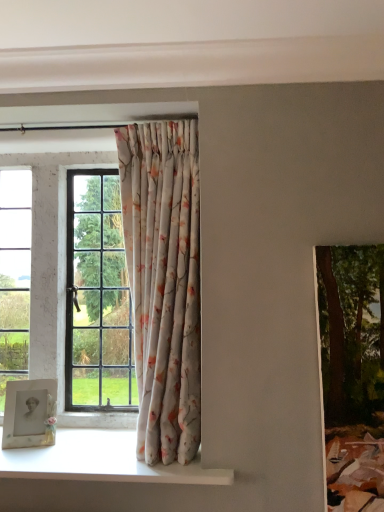
Question: Does matte white picture frame at lower left appear on the right side of floral fabric curtain at center?

Choices:
 (A) no
 (B) yes

Answer: (A)

Question: Is matte white picture frame at lower left beside floral fabric curtain at center?

Choices:
 (A) yes
 (B) no

Answer: (B)

Question: Is matte white picture frame at lower left oriented towards floral fabric curtain at center?

Choices:
 (A) no
 (B) yes

Answer: (A)

Question: Is matte white picture frame at lower left to the left of floral fabric curtain at center from the viewer's perspective?

Choices:
 (A) no
 (B) yes

Answer: (B)

Question: Considering the relative sizes of matte white picture frame at lower left and floral fabric curtain at center in the image provided, is matte white picture frame at lower left bigger than floral fabric curtain at center?

Choices:
 (A) yes
 (B) no

Answer: (B)

Question: Considering the relative sizes of matte white picture frame at lower left and floral fabric curtain at center in the image provided, is matte white picture frame at lower left thinner than floral fabric curtain at center?

Choices:
 (A) yes
 (B) no

Answer: (A)

Question: Is green textured painting at right positioned behind matte white picture frame at lower left?

Choices:
 (A) no
 (B) yes

Answer: (A)

Question: Does green textured painting at right have a lesser height compared to matte white picture frame at lower left?

Choices:
 (A) yes
 (B) no

Answer: (B)

Question: Can you confirm if green textured painting at right is positioned to the left of matte white picture frame at lower left?

Choices:
 (A) yes
 (B) no

Answer: (B)

Question: Can you confirm if green textured painting at right is bigger than matte white picture frame at lower left?

Choices:
 (A) yes
 (B) no

Answer: (A)

Question: Does green textured painting at right have a greater height compared to matte white picture frame at lower left?

Choices:
 (A) no
 (B) yes

Answer: (B)

Question: Is green textured painting at right outside matte white picture frame at lower left?

Choices:
 (A) no
 (B) yes

Answer: (B)

Question: Is matte white picture frame at lower left turned away from white glossy window sill at lower left?

Choices:
 (A) no
 (B) yes

Answer: (A)